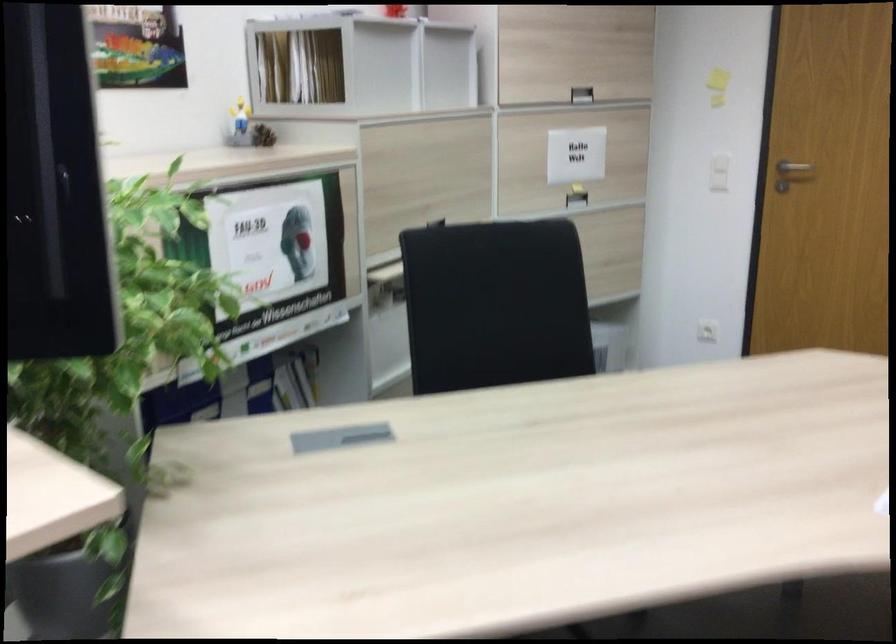
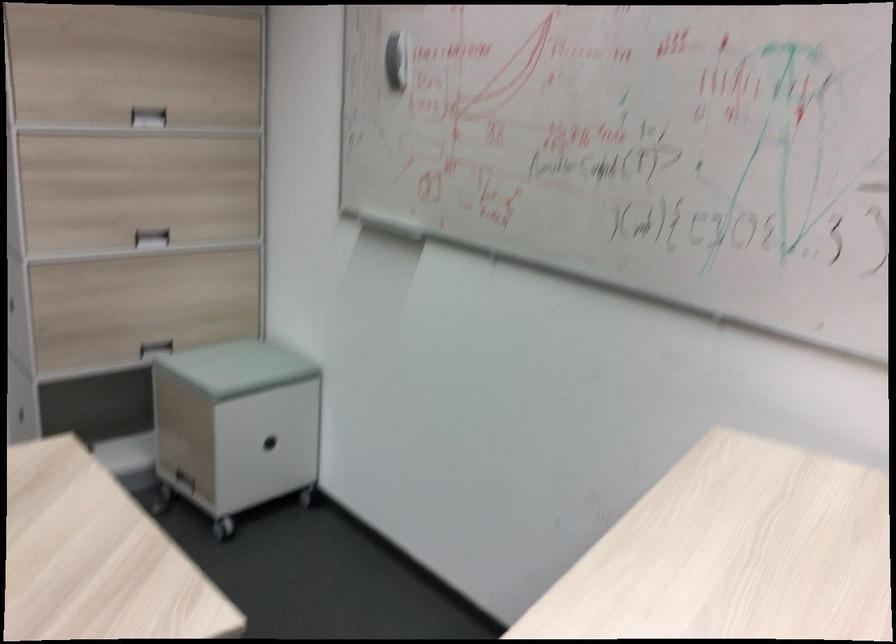
Question: Based on the continuous images, in which direction is the camera rotating? Reply with the corresponding letter.

Choices:
 (A) Left
 (B) Right
 (C) Up
 (D) Down

Answer: (B)